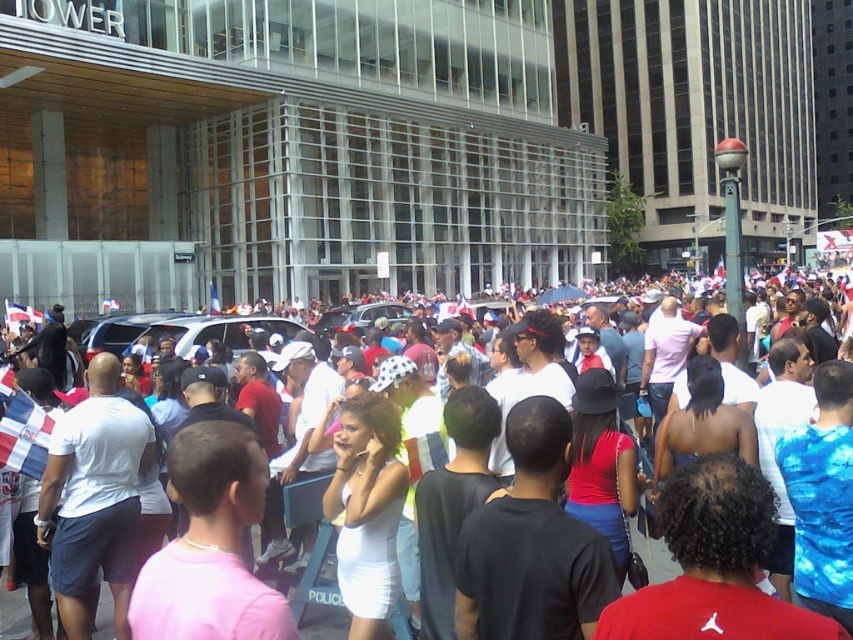
Which of these two, white cotton crowd at center or silver metallic suv at center, stands shorter?

Standing shorter between the two is silver metallic suv at center.

Who is more distant from viewer, [108,625] or [233,330]?

Point [233,330]

I want to click on white cotton crowd at center, so click(323, 620).